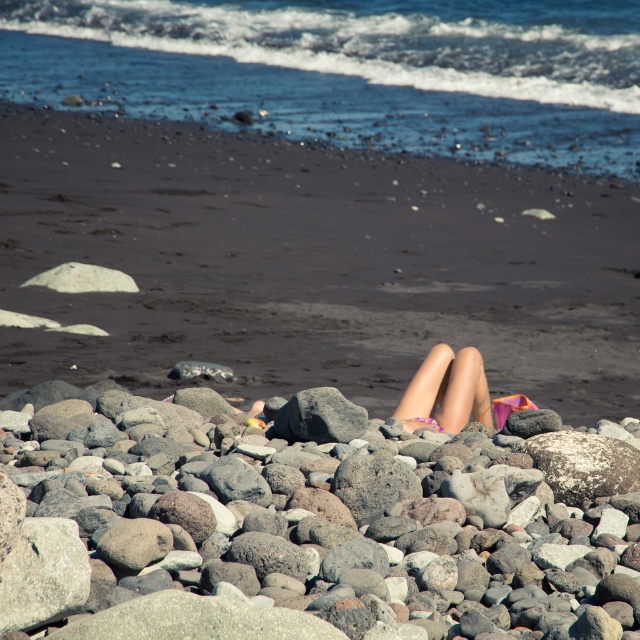
You are standing on the beach and notice the gray rough rock at lower center and the pink fabric legs at center. Which object is larger in size?

The gray rough rock at lower center is bigger than the pink fabric legs at center.

You are standing at the edge of the beach and see the gray rough rock at lower center and the gray rock at center. Which rock is closer to you?

The gray rough rock at lower center is closer to you because it is in front of the gray rock at center.